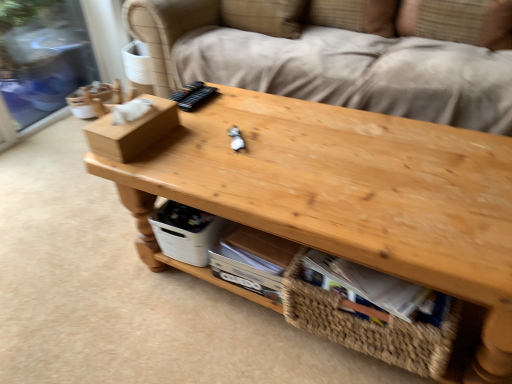
The width and height of the screenshot is (512, 384). I want to click on empty space that is ontop of natural wood table at center, so click(324, 150).